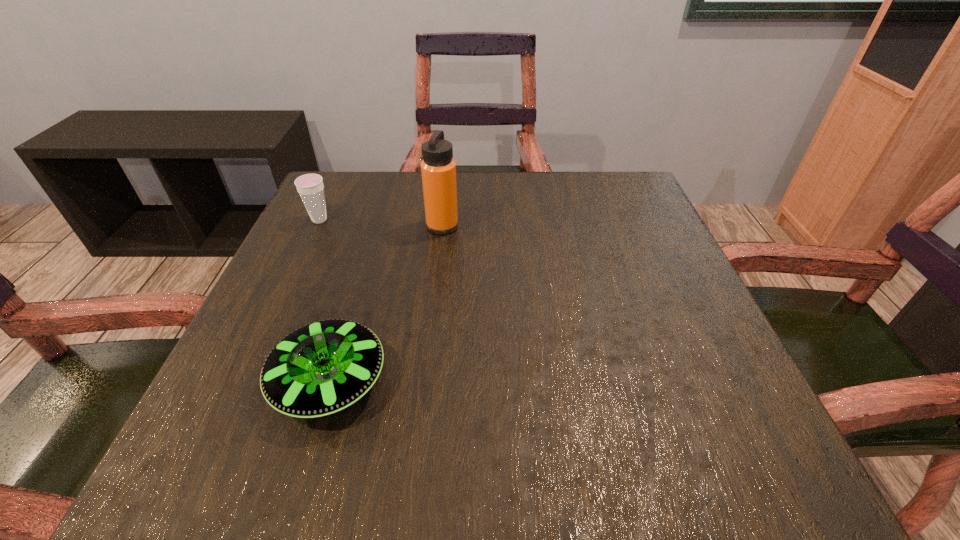
You are a GUI agent. You are given a task and a screenshot of the screen. Output one action in this format:
    pyautogui.click(x=<x>, y=<y>)
    Task: Click on the vacant space at the near left corner of the desktop
    This screenshot has height=540, width=960.
    Given the screenshot: What is the action you would take?
    pyautogui.click(x=248, y=467)

Identify the location of vacant position at the far right corner of the desktop. (593, 215).

This screenshot has height=540, width=960. In order to click on free spot between the cup and the second object from left to right in this screenshot , I will do coord(324,301).

At what (x,y) coordinates should I click in order to perform the action: click on free point between the leftmost object and the thermos bottle. Please return your answer as a coordinate pair (x, y). This screenshot has height=540, width=960. Looking at the image, I should click on (381, 223).

The image size is (960, 540). Find the location of `free spot between the tallest object and the saucer`. free spot between the tallest object and the saucer is located at coordinates (386, 304).

The image size is (960, 540). What are the coordinates of `vacant area that lies between the cup and the second object from left to right` in the screenshot? It's located at (324, 301).

Where is `free space between the cup and the shortest object`? The image size is (960, 540). free space between the cup and the shortest object is located at coordinates (324, 301).

At what (x,y) coordinates should I click in order to perform the action: click on free spot between the saucer and the tallest object. Please return your answer as a coordinate pair (x, y). The height and width of the screenshot is (540, 960). Looking at the image, I should click on (386, 304).

Locate an element on the screen. free space between the saucer and the rightmost object is located at coordinates (386, 304).

Identify the location of unoccupied area between the tallest object and the second object from right to left. The image size is (960, 540). (386, 304).